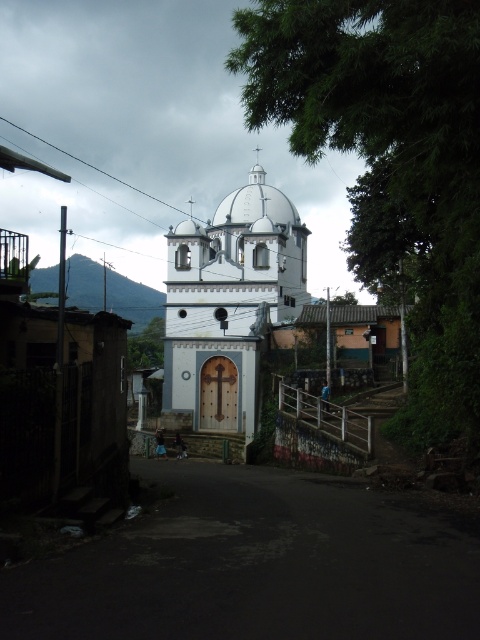
Question: Which point is farther from the camera taking this photo?

Choices:
 (A) (215, 401)
 (B) (181, 531)

Answer: (A)

Question: Does dark asphalt road at center appear over white smooth church at center?

Choices:
 (A) yes
 (B) no

Answer: (B)

Question: Does dark asphalt road at center have a greater width compared to white smooth church at center?

Choices:
 (A) yes
 (B) no

Answer: (B)

Question: Which point appears closest to the camera in this image?

Choices:
 (A) (460, 577)
 (B) (223, 428)

Answer: (A)

Question: Is dark asphalt road at center above white smooth church at center?

Choices:
 (A) no
 (B) yes

Answer: (A)